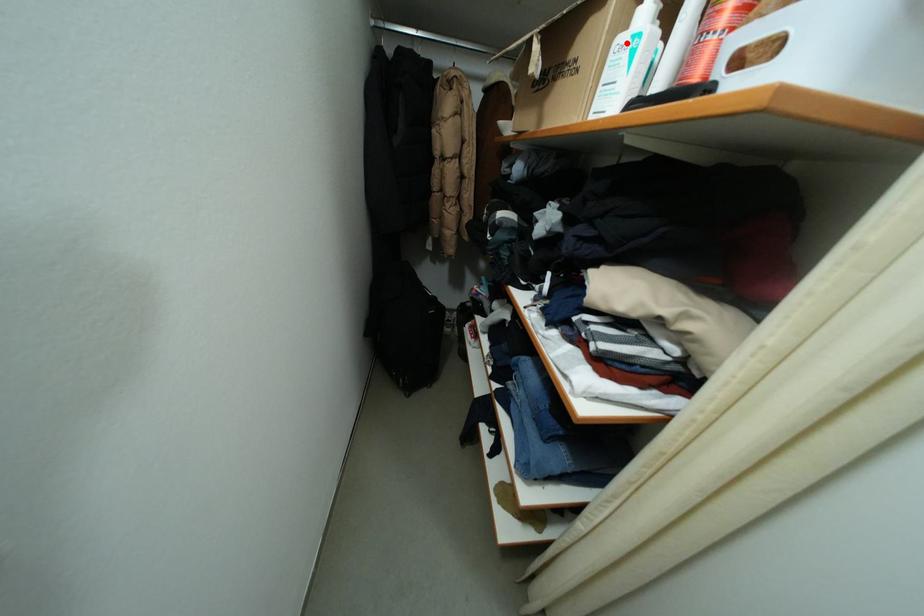
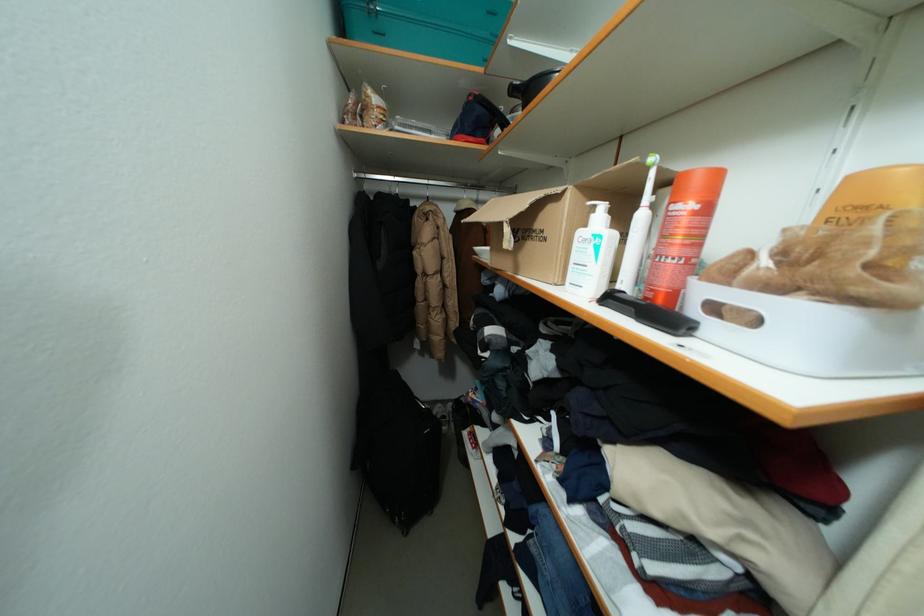
Locate, in the second image, the point that corresponds to the highlighted location in the first image.

(589, 236)